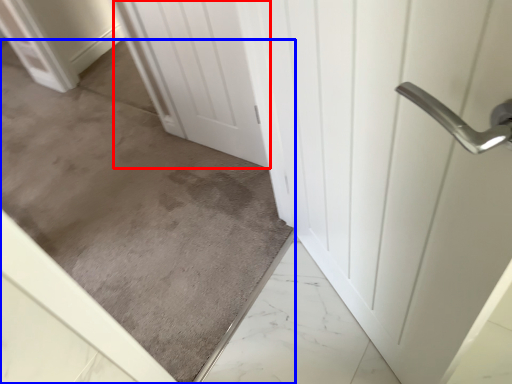
Question: Which object is further to the camera taking this photo, door (highlighted by a red box) or concrete (highlighted by a blue box)?

Choices:
 (A) door
 (B) concrete

Answer: (A)